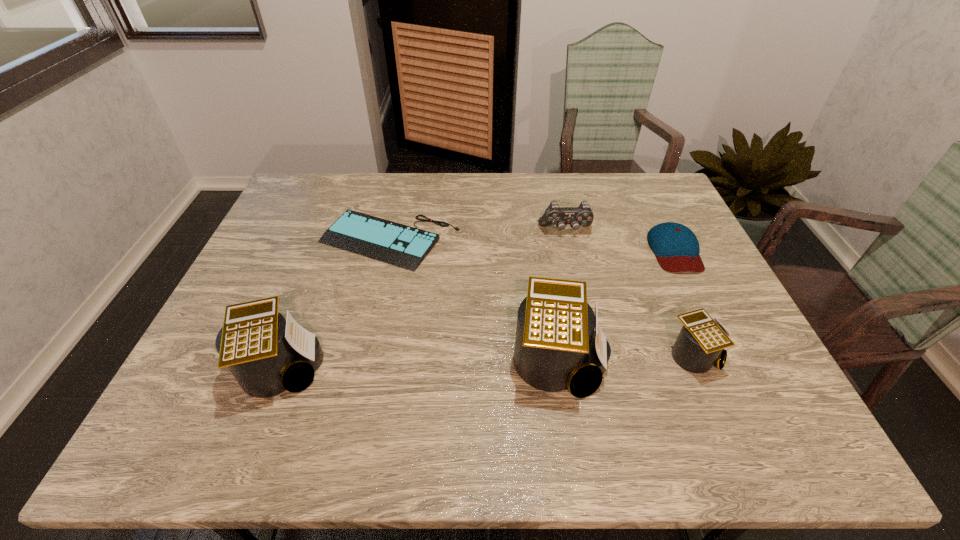
Please point a space for a new calculator to maintain equal intervals. Please provide its 2D coordinates. Your answer should be formatted as a tuple, i.e. [(x, y)], where the tuple contains the x and y coordinates of a point satisfying the conditions above.

[(421, 365)]